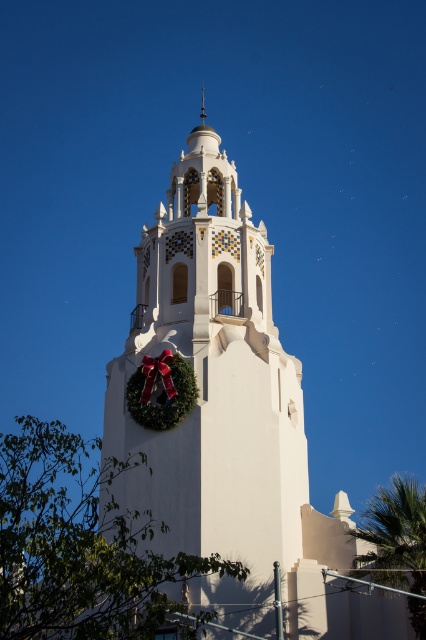
Question: Which of the following is the closest to the observer?

Choices:
 (A) white matte tower at center
 (B) green leafy palm tree at lower right

Answer: (B)

Question: Is white matte tower at center thinner than green leafy palm tree at lower right?

Choices:
 (A) no
 (B) yes

Answer: (B)

Question: Is the position of white matte tower at center less distant than that of green leafy palm tree at lower right?

Choices:
 (A) no
 (B) yes

Answer: (A)

Question: Is white matte tower at center closer to camera compared to green leafy palm tree at lower right?

Choices:
 (A) no
 (B) yes

Answer: (A)

Question: Which of the following is the farthest from the observer?

Choices:
 (A) green leafy palm tree at lower right
 (B) white matte tower at center

Answer: (B)

Question: Which point is farther from the camera taking this photo?

Choices:
 (A) (278, 488)
 (B) (414, 532)

Answer: (A)